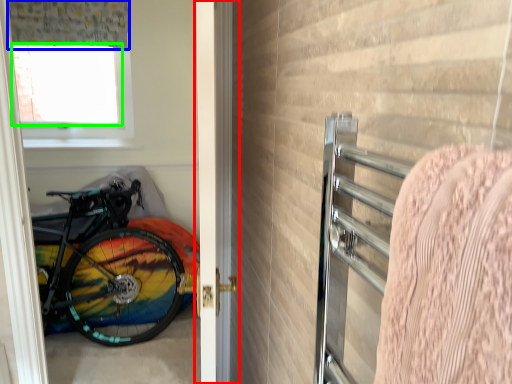
Question: Which is farther away from door (highlighted by a red box)? curtain (highlighted by a blue box) or window screen (highlighted by a green box)?

Choices:
 (A) curtain
 (B) window screen

Answer: (B)